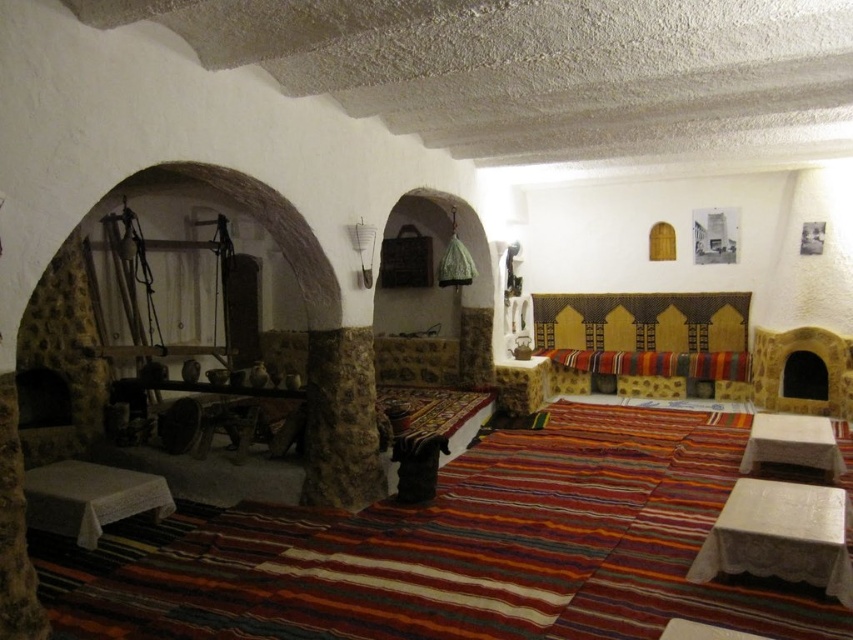
Consider the image. Is textured wool rug at center shorter than white cloth-covered table at lower right?

Correct, textured wool rug at center is not as tall as white cloth-covered table at lower right.

Is textured wool rug at center above white cloth-covered table at lower right?

No.

Is point (183, 548) positioned in front of point (747, 564)?

No, (183, 548) is further to viewer.

Locate an element on the screen. The height and width of the screenshot is (640, 853). textured wool rug at center is located at coordinates (471, 552).

Does white cloth-covered table at lower right appear under white cloth-covered table at lower left?

No.

Between white cloth-covered table at lower right and white cloth-covered table at lower left, which one has more height?

white cloth-covered table at lower right

Does point (833, 518) come closer to viewer compared to point (42, 502)?

Yes, it is in front of point (42, 502).

At what (x,y) coordinates should I click in order to perform the action: click on white cloth-covered table at lower right. Please return your answer as a coordinate pair (x, y). The height and width of the screenshot is (640, 853). Looking at the image, I should click on (780, 536).

Measure the distance between white cloth-covered table at lower right and white fabric table at lower right.

white cloth-covered table at lower right and white fabric table at lower right are 1.55 meters apart.

Find the location of a particular element. Image resolution: width=853 pixels, height=640 pixels. white cloth-covered table at lower right is located at coordinates (780, 536).

Does point (814, 536) come closer to viewer compared to point (763, 432)?

Yes, it is.

This screenshot has width=853, height=640. I want to click on white cloth-covered table at lower right, so click(x=780, y=536).